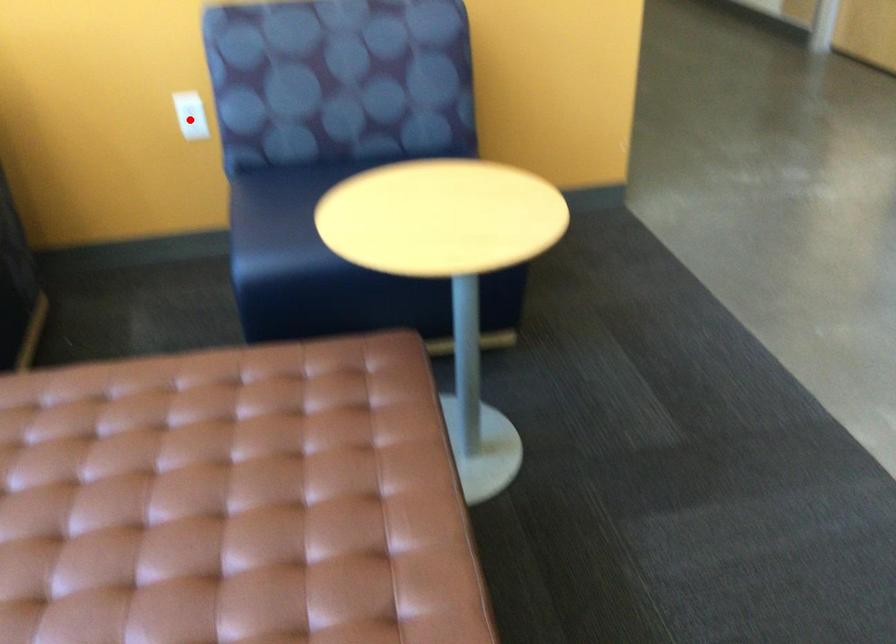
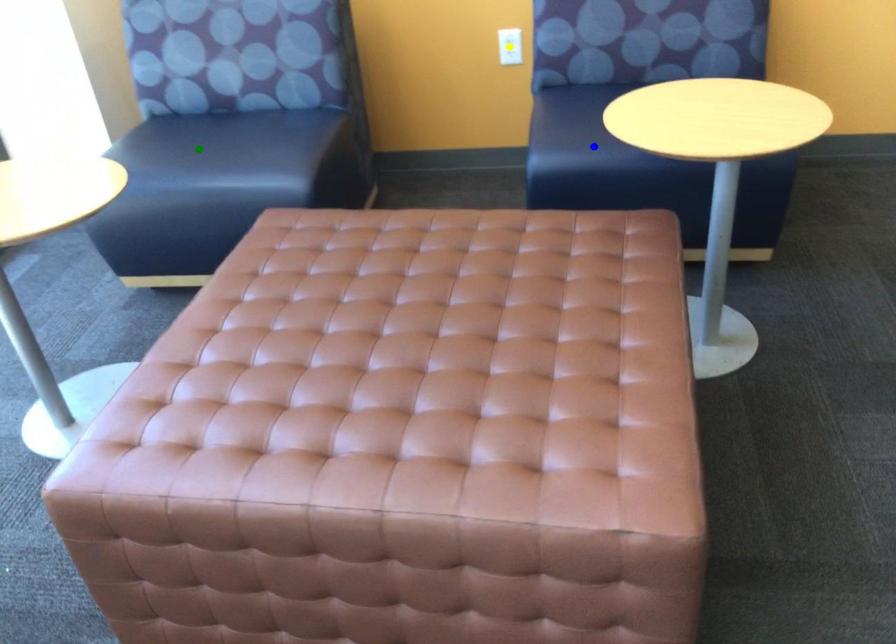
Question: I am providing you with two images of the same scene from different viewpoints. A red point is marked on the first image. You are given multiple points on the second image. In image 2, which mark is for the same physical point as the one in image 1?

Choices:
 (A) yellow point
 (B) blue point
 (C) green point

Answer: (A)